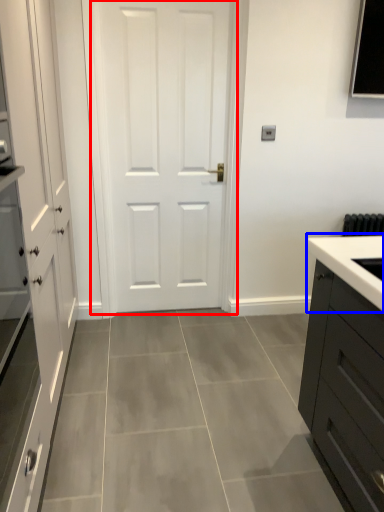
Question: Which point is further to the camera, door (highlighted by a red box) or sink (highlighted by a blue box)?

Choices:
 (A) door
 (B) sink

Answer: (B)